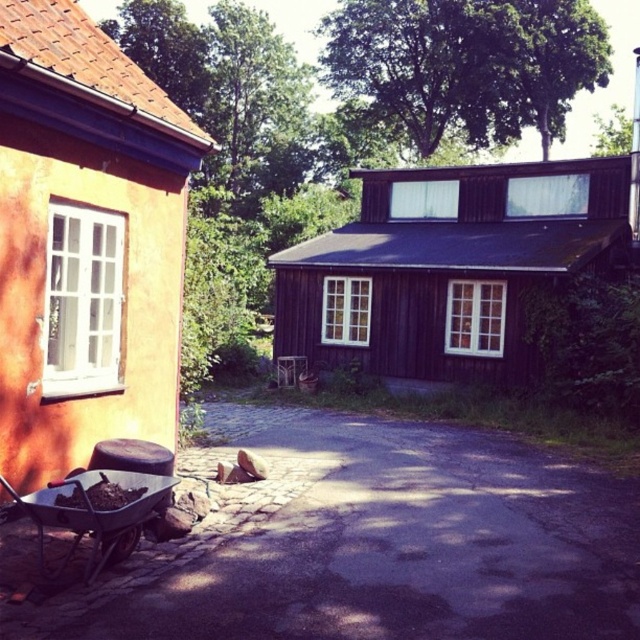
Question: Does dark gray asphalt at center appear under metallic wheelbarrow at lower left?

Choices:
 (A) yes
 (B) no

Answer: (A)

Question: Can you confirm if dark gray asphalt at center is smaller than metallic wheelbarrow at lower left?

Choices:
 (A) no
 (B) yes

Answer: (A)

Question: Which point is closer to the camera taking this photo?

Choices:
 (A) (419, 512)
 (B) (173, 486)

Answer: (B)

Question: Which object appears closest to the camera in this image?

Choices:
 (A) dark gray asphalt at center
 (B) metallic wheelbarrow at lower left

Answer: (A)

Question: Does dark gray asphalt at center appear over metallic wheelbarrow at lower left?

Choices:
 (A) yes
 (B) no

Answer: (B)